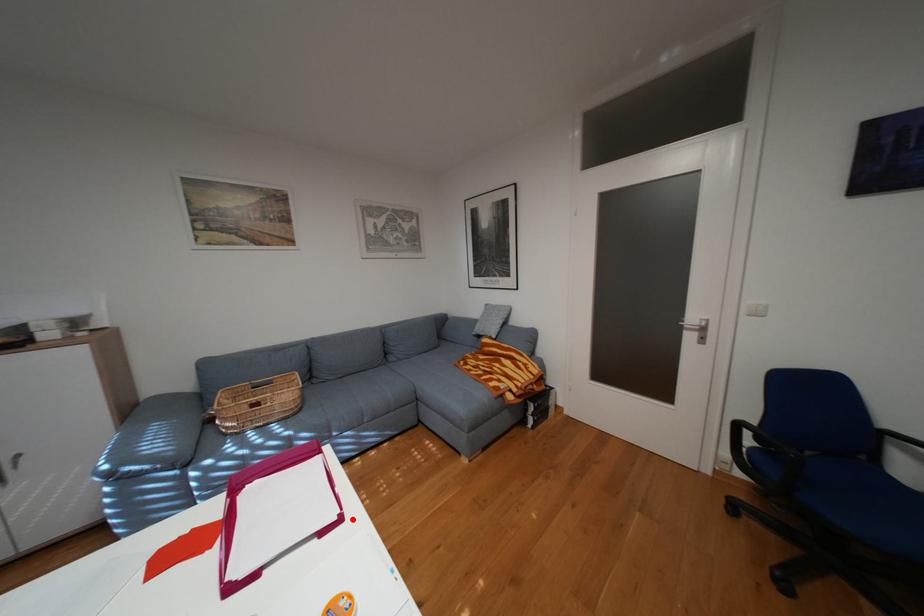
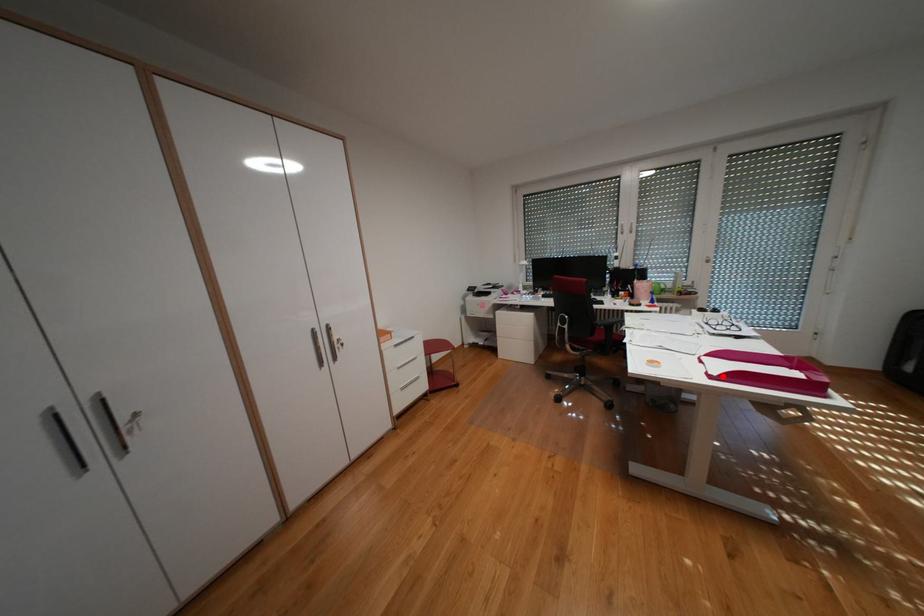
I am providing you with two images of the same scene from different viewpoints. A red point is marked on the first image and another point is marked on the second image. Is the marked point in image1 the same physical position as the marked point in image2?

Yes